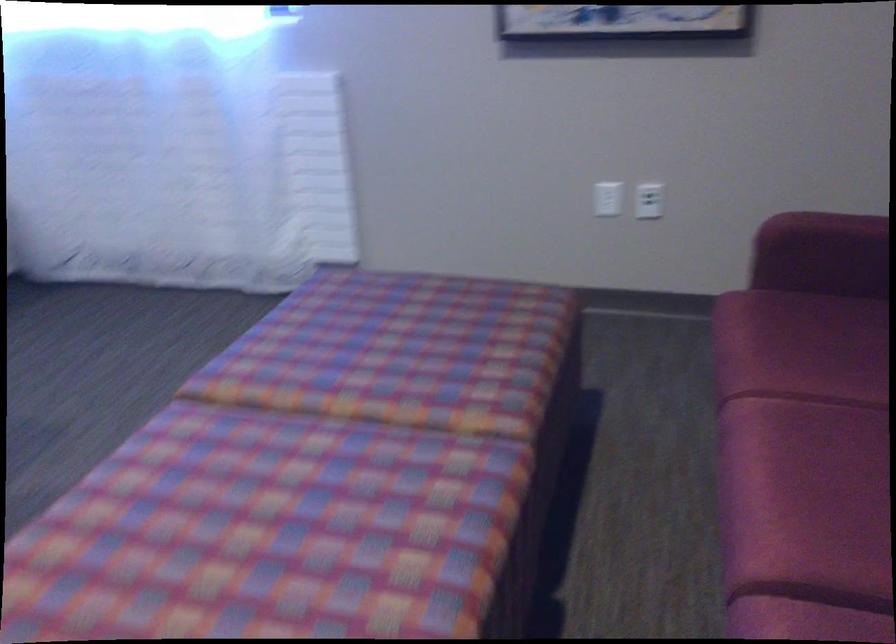
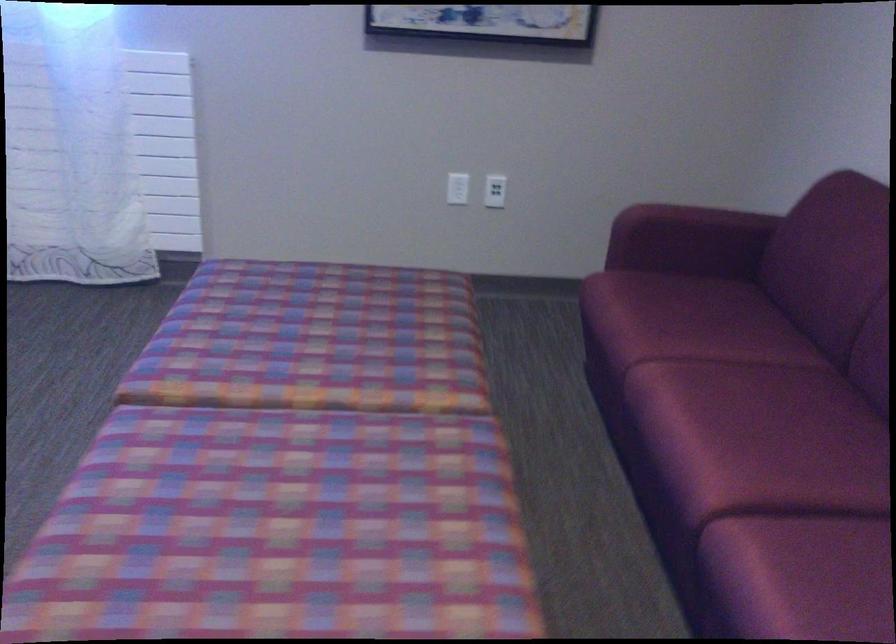
Find the pixel in the second image that matches (600,198) in the first image.

(458, 187)